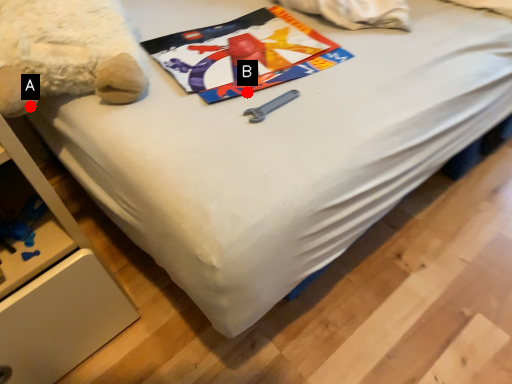
Question: Two points are circled on the image, labeled by A and B beside each circle. Which point is further to the camera?

Choices:
 (A) A is further
 (B) B is further

Answer: (B)